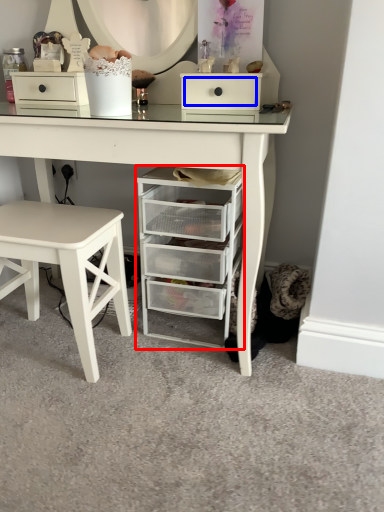
Question: Which object appears closest to the camera in this image, chest of drawers (highlighted by a red box) or drawer (highlighted by a blue box)?

Choices:
 (A) chest of drawers
 (B) drawer

Answer: (A)